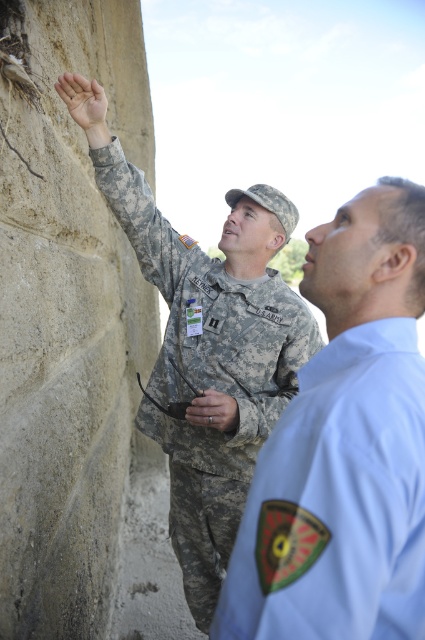
Is light blue uniform at upper right above camouflage fabric uniform at upper left?

Yes, light blue uniform at upper right is above camouflage fabric uniform at upper left.

What do you see at coordinates (345, 448) in the screenshot? The height and width of the screenshot is (640, 425). I see `light blue uniform at upper right` at bounding box center [345, 448].

The height and width of the screenshot is (640, 425). What are the coordinates of `light blue uniform at upper right` in the screenshot? It's located at coord(345,448).